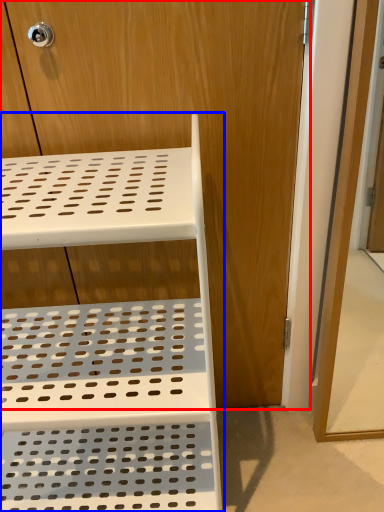
Question: Which point is further to the camera, dresser (highlighted by a red box) or furniture (highlighted by a blue box)?

Choices:
 (A) dresser
 (B) furniture

Answer: (A)